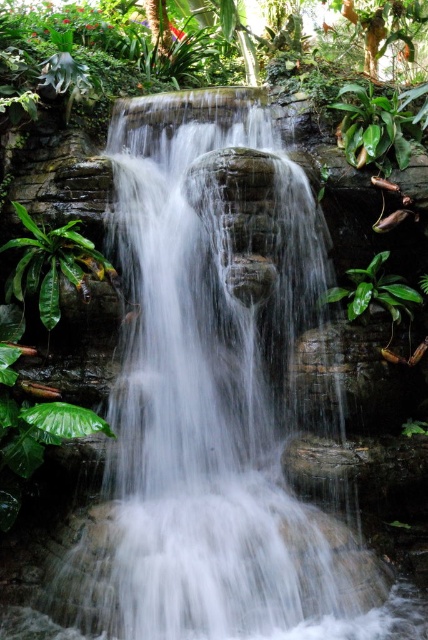
Which is behind, point (47, 289) or point (404, 284)?

Point (404, 284)

Image resolution: width=428 pixels, height=640 pixels. What are the coordinates of `green leafy plant at left` in the screenshot? It's located at (51, 264).

Where is `green leafy plant at left`? green leafy plant at left is located at coordinates (51, 264).